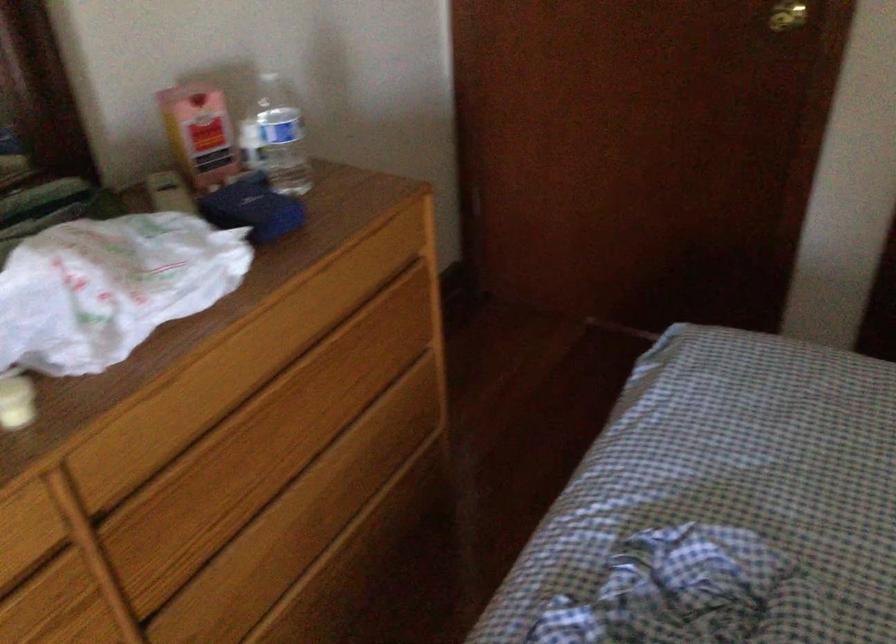
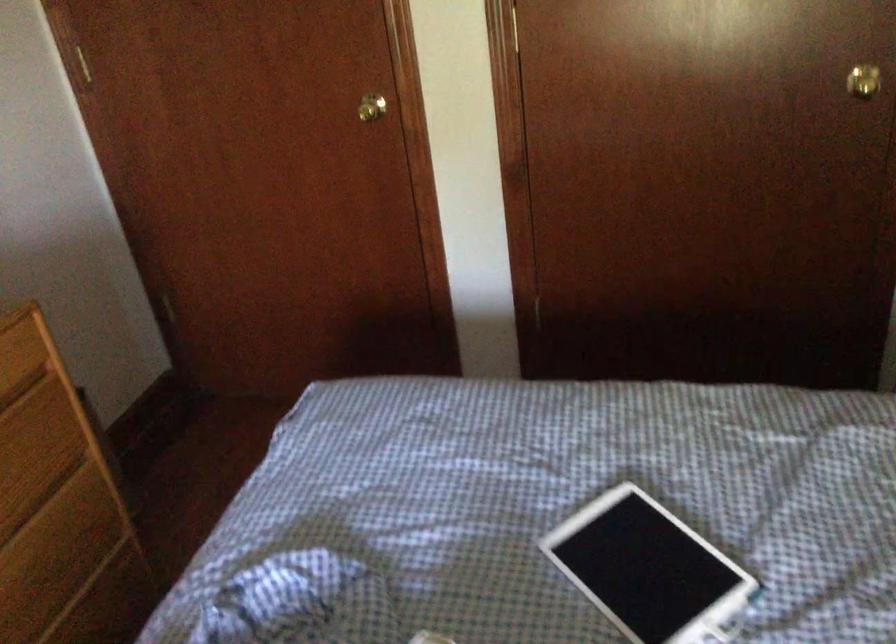
Question: The camera is either moving clockwise (left) or counter-clockwise (right) around the object. The first image is from the beginning of the video and the second image is from the end. Is the camera moving left or right when shooting the video?

Choices:
 (A) Left
 (B) Right

Answer: (A)